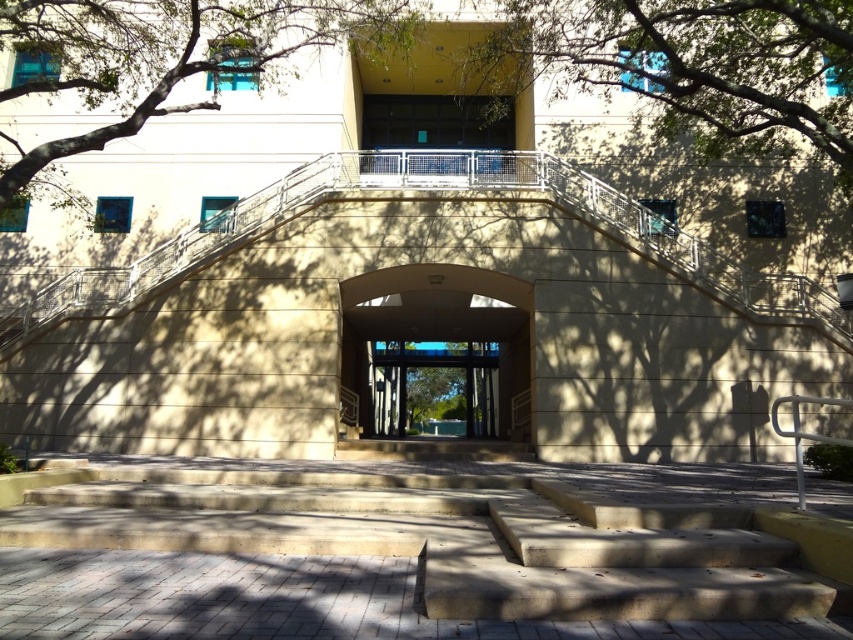
You are a maintenance worker who needs to move a ladder from the green leafy tree at upper left to the clear glass doors at center. The ladder is 15 feet long. Can you carry it horizontally between these two points without tilting it vertically?

The distance between the green leafy tree at upper left and the clear glass doors at center is 48.45 feet. Since the ladder is only 15 feet long, it can be easily carried horizontally between these two points without needing to tilt it vertically.

You are standing at the bottom of the stairs leading up to the entrance of the modern building. You notice a point marked at coordinates (693,67). What object is located at that specific point?

The point at coordinates (693,67) is where the green leafy tree at upper center is located.